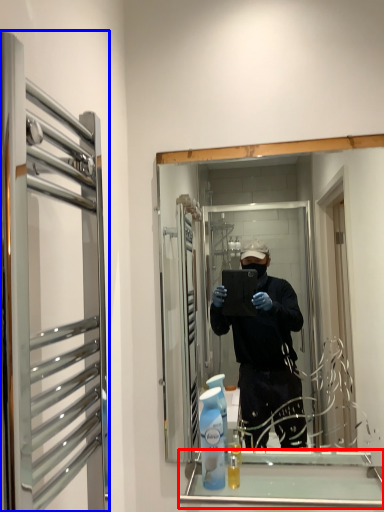
Question: Which point is closer to the camera, cabinet (highlighted by a red box) or glass door (highlighted by a blue box)?

Choices:
 (A) cabinet
 (B) glass door

Answer: (B)